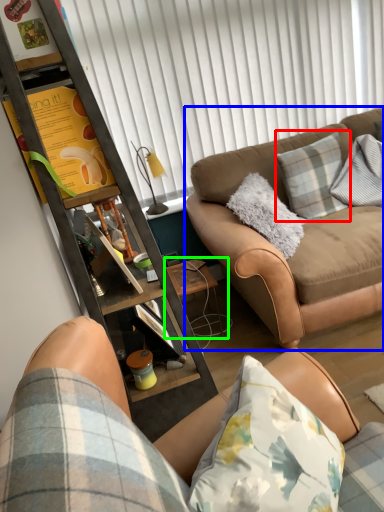
Question: Which is nearer to the pillow (highlighted by a red box)? studio couch (highlighted by a blue box) or side table (highlighted by a green box).

Choices:
 (A) studio couch
 (B) side table

Answer: (A)